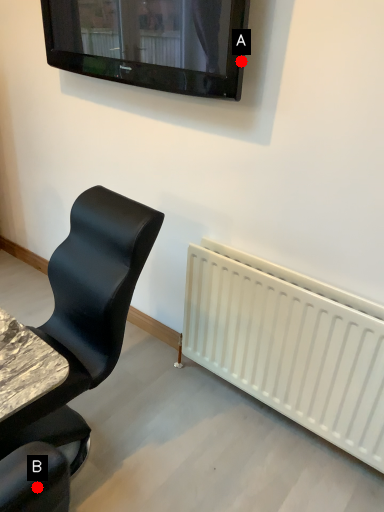
Question: Two points are circled on the image, labeled by A and B beside each circle. Which point appears farthest from the camera in this image?

Choices:
 (A) A is further
 (B) B is further

Answer: (A)